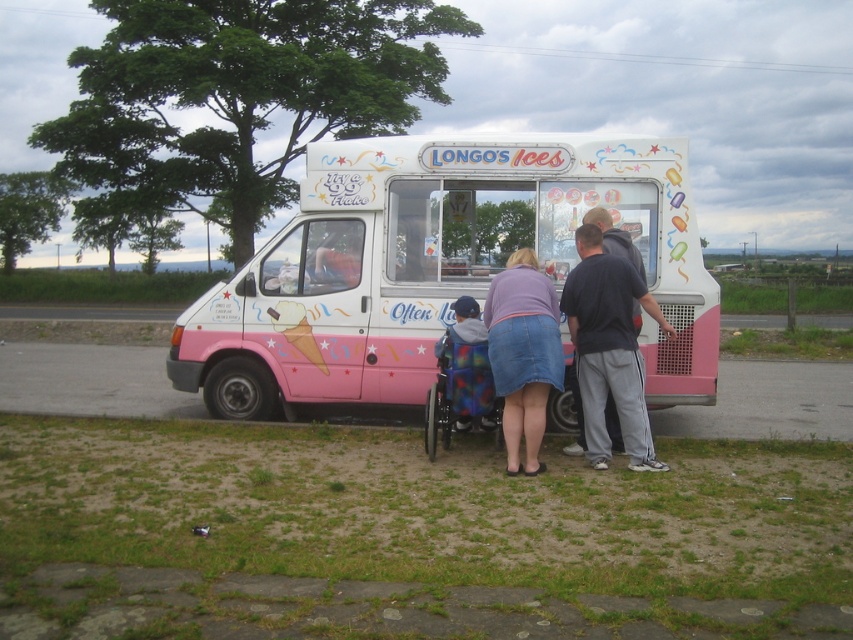
Question: Does rainbow fabric wheelchair at center appear over dark gray sweatpants at center?

Choices:
 (A) no
 (B) yes

Answer: (A)

Question: Which object appears farthest from the camera in this image?

Choices:
 (A) dark gray sweatpants at center
 (B) purple denim skirt at lower center
 (C) pink matte ice cream truck at center

Answer: (C)

Question: Which object is closer to the camera taking this photo?

Choices:
 (A) dark gray sweatpants at center
 (B) pink matte ice cream truck at center

Answer: (A)

Question: Does pink matte ice cream truck at center appear over dark gray sweatpants at center?

Choices:
 (A) yes
 (B) no

Answer: (A)

Question: Which point is closer to the camera taking this photo?

Choices:
 (A) (521, 412)
 (B) (476, 374)

Answer: (A)

Question: Can you confirm if rainbow fabric wheelchair at center is smaller than dark gray sweatpants at center?

Choices:
 (A) yes
 (B) no

Answer: (B)